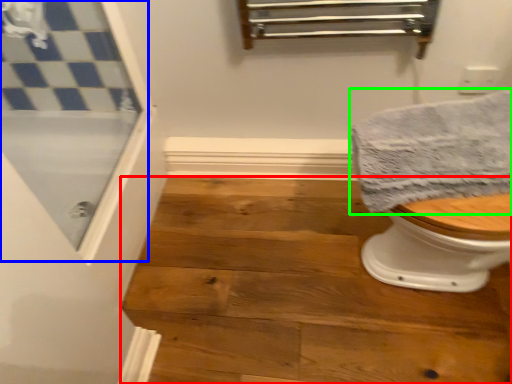
Question: Which object is positioned closest to stair (highlighted by a red box)? Select from screen door (highlighted by a blue box) and towel (highlighted by a green box).

Choices:
 (A) screen door
 (B) towel

Answer: (B)